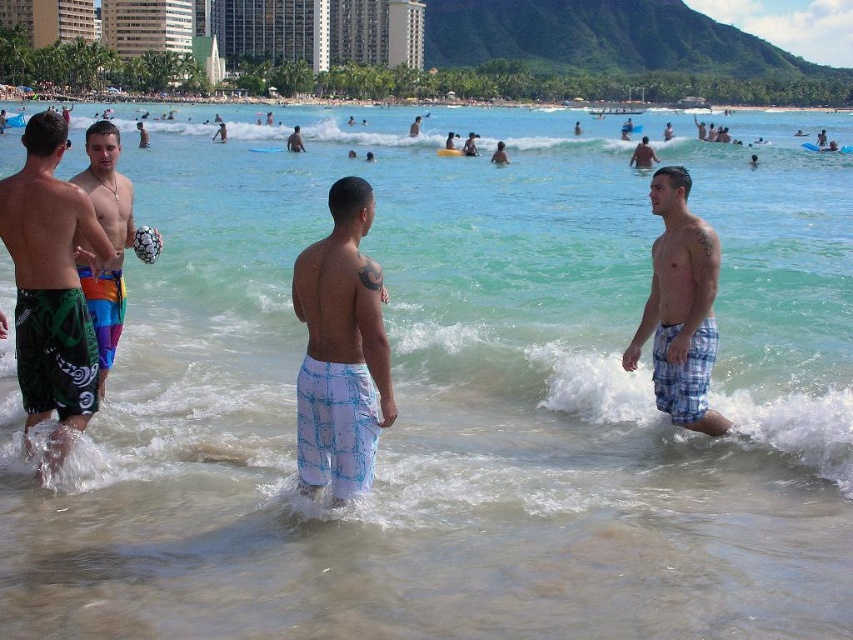
You are a photographer trying to capture a photo of the beach scene. You need to ensure that both the white plaid shorts at center and the light blue plaid shorts at upper right are clearly visible in the frame. Given their sizes, which pair of shorts might appear smaller in the final photo?

The white plaid shorts at center has a smaller size compared to light blue plaid shorts at upper right, so it will appear smaller in the photo.